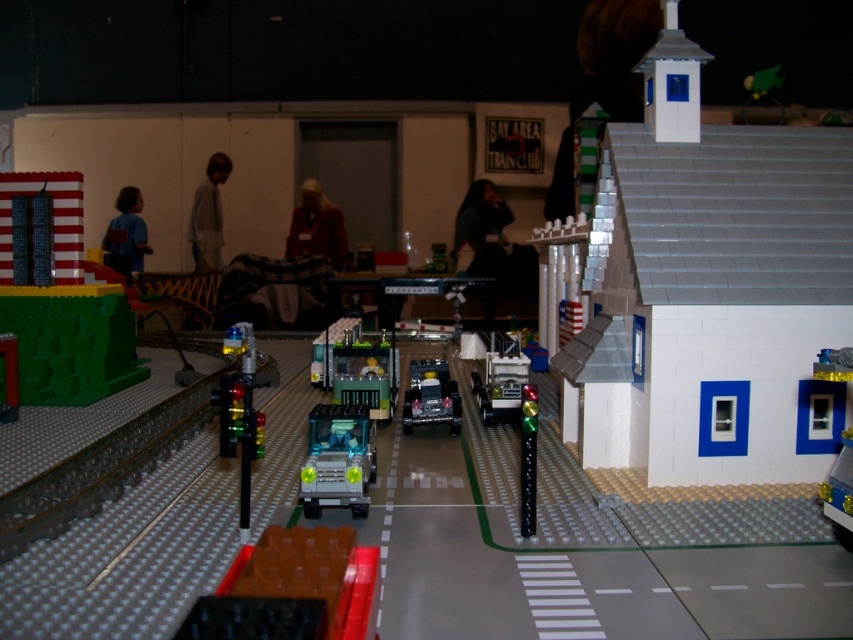
You are a Lego figure standing at the origin point of the diorama. You need to reach the green matte building at left. What are the coordinates of the building?

The coordinates of the green matte building at left are at point [62,304].